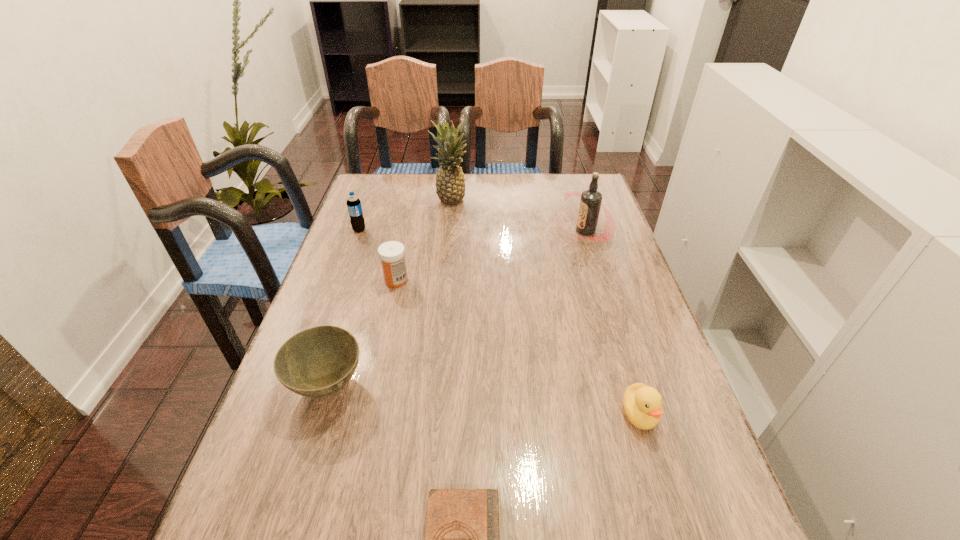
Where is `vacant region at the far edge`? The height and width of the screenshot is (540, 960). vacant region at the far edge is located at coordinates (487, 200).

At what (x,y) coordinates should I click in order to perform the action: click on free spot at the left edge of the desktop. Please return your answer as a coordinate pair (x, y). This screenshot has width=960, height=540. Looking at the image, I should click on (378, 222).

In the image, there is a desktop. At what (x,y) coordinates should I click in order to perform the action: click on vacant region at the right edge. Please return your answer as a coordinate pair (x, y). Looking at the image, I should click on (615, 240).

Identify the location of vacant point at the far right corner. The image size is (960, 540). (579, 176).

Where is `free area in between the second tallest object and the tallest object`? The width and height of the screenshot is (960, 540). free area in between the second tallest object and the tallest object is located at coordinates (517, 216).

You are a GUI agent. You are given a task and a screenshot of the screen. Output one action in this format:
    pyautogui.click(x=<x>, y=<y>)
    Task: Click on the free space that is in between the duckling and the fourth farthest object
    
    Given the screenshot: What is the action you would take?
    click(517, 347)

The width and height of the screenshot is (960, 540). What are the coordinates of `vacant point located between the duckling and the bowl` in the screenshot? It's located at (484, 400).

Image resolution: width=960 pixels, height=540 pixels. I want to click on vacant space that is in between the medicine and the fifth shortest object, so click(x=377, y=255).

The image size is (960, 540). I want to click on free area in between the root beer and the tallest object, so click(517, 216).

Identify the location of object that is the sixth nearest to the fourth nearest object. This screenshot has width=960, height=540. (642, 404).